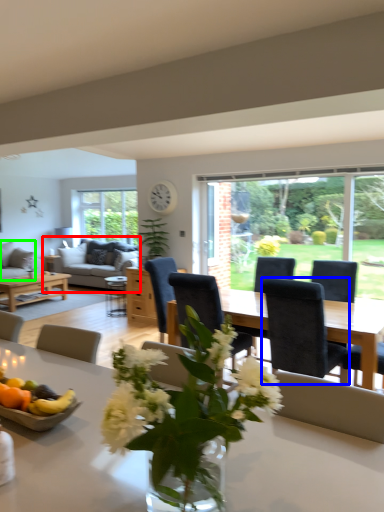
Question: Based on their relative distances, which object is nearer to studio couch (highlighted by a red box)? Choose from chair (highlighted by a blue box) and studio couch (highlighted by a green box).

Choices:
 (A) chair
 (B) studio couch

Answer: (B)